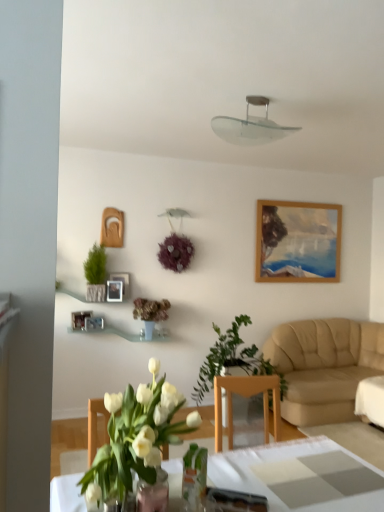
Where is `free space above clear glass lampshade at upper center (from a real-world perspective)`? free space above clear glass lampshade at upper center (from a real-world perspective) is located at coordinates (258, 93).